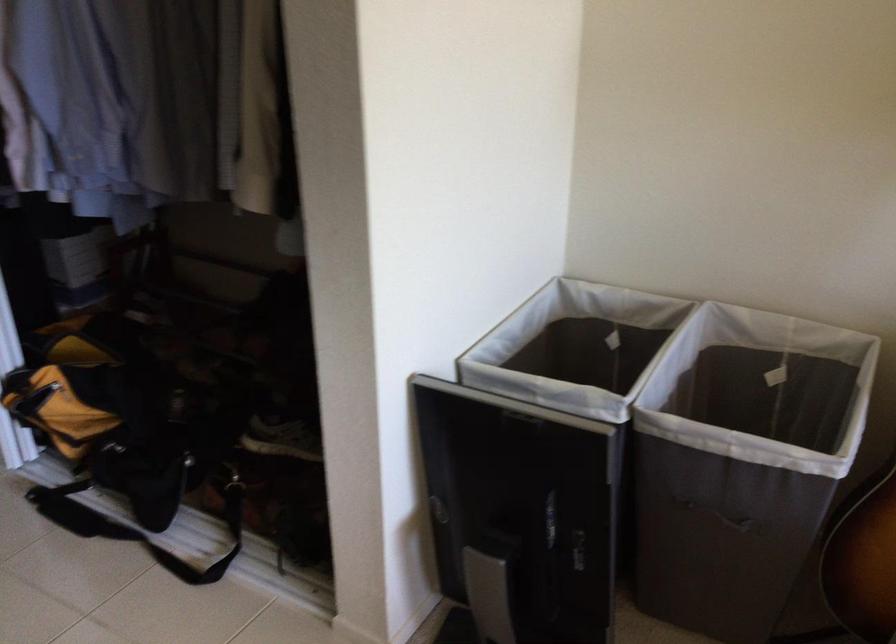
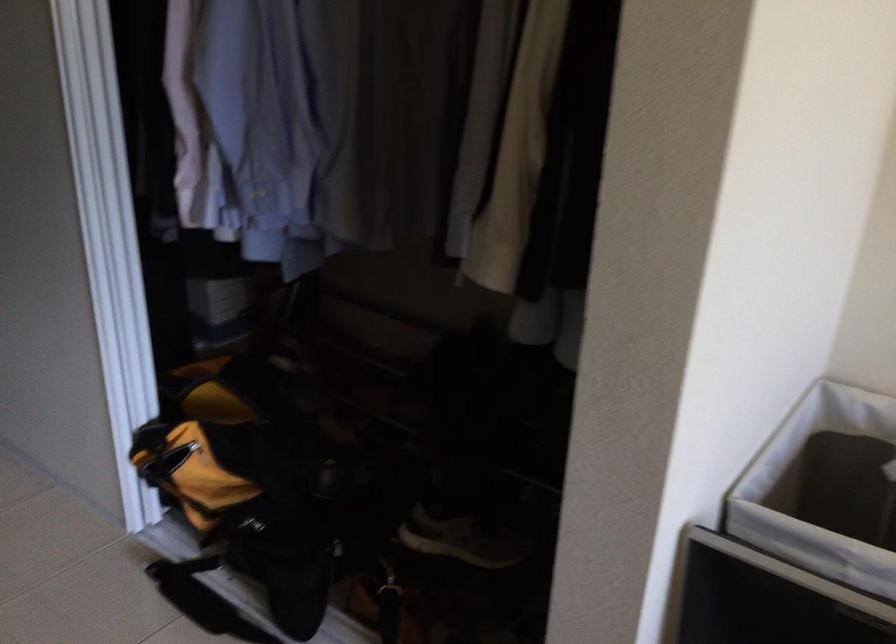
Find the pixel in the second image that matches point 295,435 in the first image.

(461, 540)